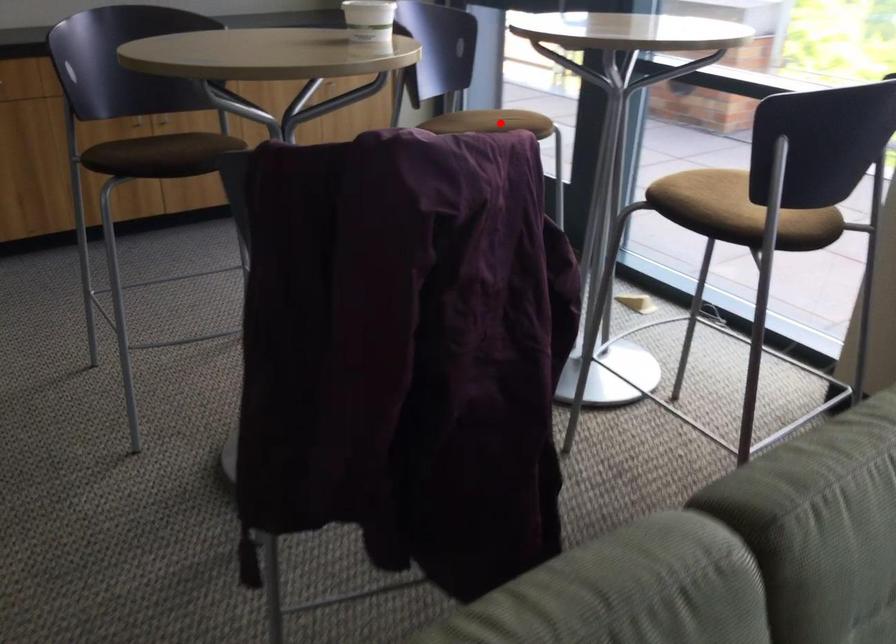
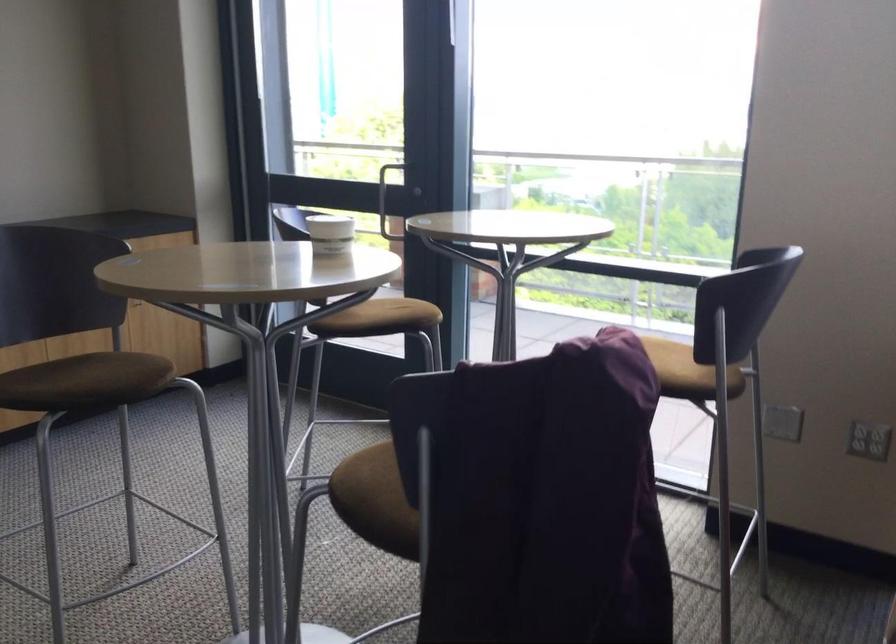
Find the pixel in the second image that matches the highlighted location in the first image.

(401, 314)